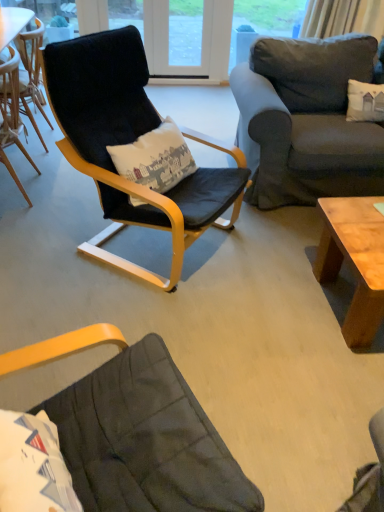
This screenshot has width=384, height=512. I want to click on free spot to the right of wooden chair at left, which is counted as the first chair, starting from the left, so click(65, 197).